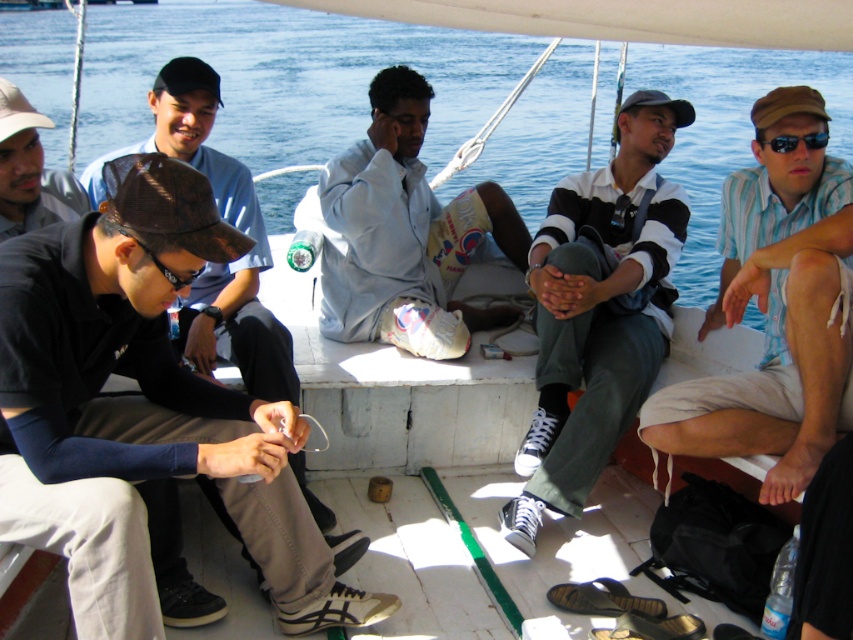
Does striped cotton shirt at right lie behind light blue fabric shirt at center?

No.

Who is more distant from viewer, [834,360] or [440,296]?

The point [440,296] is more distant.

You are a GUI agent. You are given a task and a screenshot of the screen. Output one action in this format:
    pyautogui.click(x=<x>, y=<y>)
    Task: Click on the striped cotton shirt at right
    
    Given the screenshot: What is the action you would take?
    pyautogui.click(x=776, y=305)

Is striped cotton shirt at center shorter than light blue fabric shirt at center?

No.

The width and height of the screenshot is (853, 640). What are the coordinates of `striped cotton shirt at center` in the screenshot? It's located at (599, 310).

Is point (728, 417) in front of point (598, 212)?

Yes.

Does point (735, 452) come in front of point (619, 392)?

Yes, it is.

This screenshot has height=640, width=853. In order to click on striped cotton shirt at right in this screenshot , I will do `click(776, 305)`.